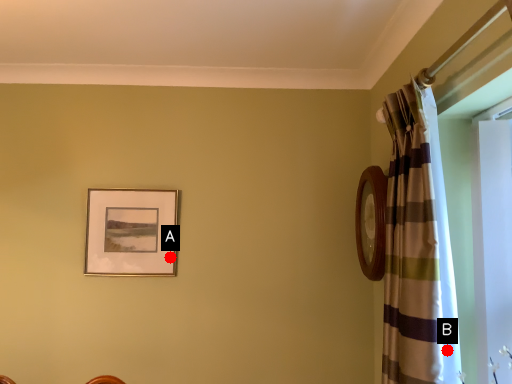
Question: Two points are circled on the image, labeled by A and B beside each circle. Which point appears closest to the camera in this image?

Choices:
 (A) A is closer
 (B) B is closer

Answer: (B)